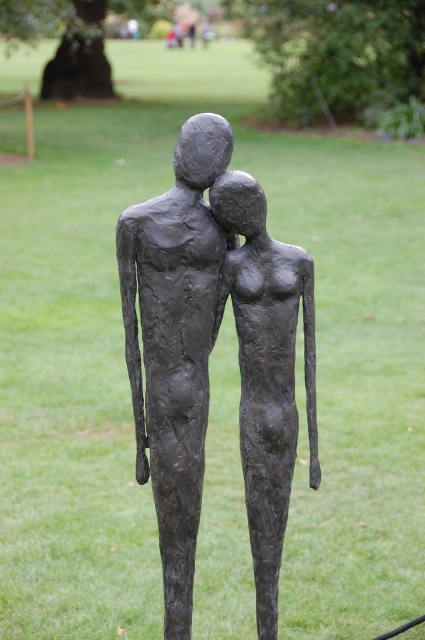
Is matte bronze couple at center closer to the viewer compared to matte bronze figure at center?

Yes, matte bronze couple at center is in front of matte bronze figure at center.

Can you confirm if matte bronze couple at center is positioned below matte bronze figure at center?

No.

Is point (130, 320) positioned before point (220, 312)?

Yes, point (130, 320) is in front of point (220, 312).

This screenshot has height=640, width=425. I want to click on matte bronze couple at center, so click(x=181, y=333).